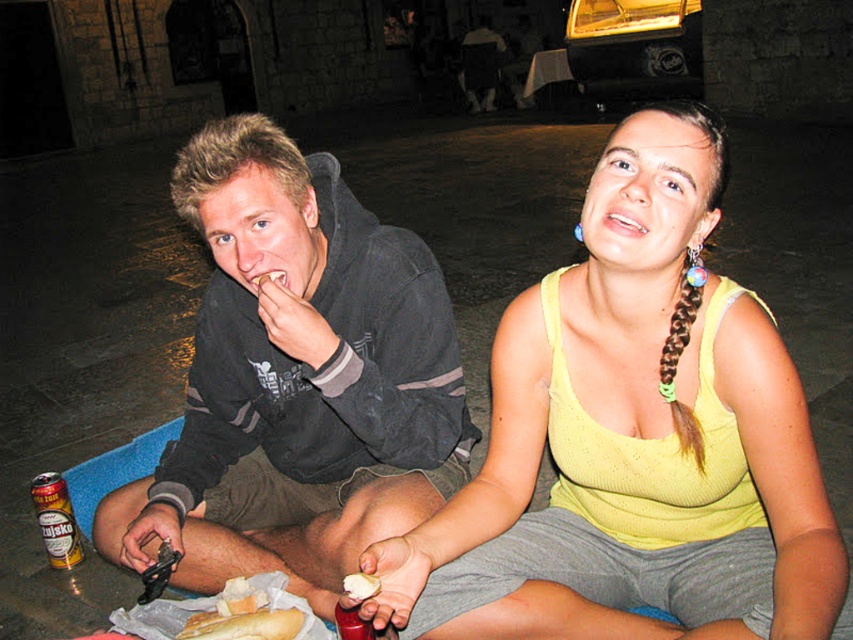
This screenshot has height=640, width=853. What do you see at coordinates (297, 378) in the screenshot?
I see `dark gray hoodie at center` at bounding box center [297, 378].

Can you confirm if dark gray hoodie at center is bigger than gold metallic can at lower left?

Yes.

Is point (309, 445) farther from camera compared to point (33, 506)?

No, (309, 445) is closer to viewer.

This screenshot has width=853, height=640. In order to click on dark gray hoodie at center in this screenshot , I will do `click(297, 378)`.

Describe the element at coordinates (297, 378) in the screenshot. The width and height of the screenshot is (853, 640). I see `dark gray hoodie at center` at that location.

Between point (442, 326) and point (619, 218), which one is positioned behind?

The point (442, 326) is behind.

Who is more forward, (405, 266) or (605, 221)?

Positioned in front is point (605, 221).

This screenshot has height=640, width=853. What are the coordinates of `dark gray hoodie at center` in the screenshot? It's located at (297, 378).

Between point (57, 474) and point (625, 218), which one is positioned in front?

Positioned in front is point (625, 218).

Who is more distant from viewer, [36,513] or [631,227]?

The point [36,513] is behind.

At what (x,y) coordinates should I click in order to perform the action: click on gold metallic can at lower left. Please return your answer as a coordinate pair (x, y). The width and height of the screenshot is (853, 640). Looking at the image, I should click on (56, 518).

Locate an element on the screen. This screenshot has height=640, width=853. gold metallic can at lower left is located at coordinates (56, 518).